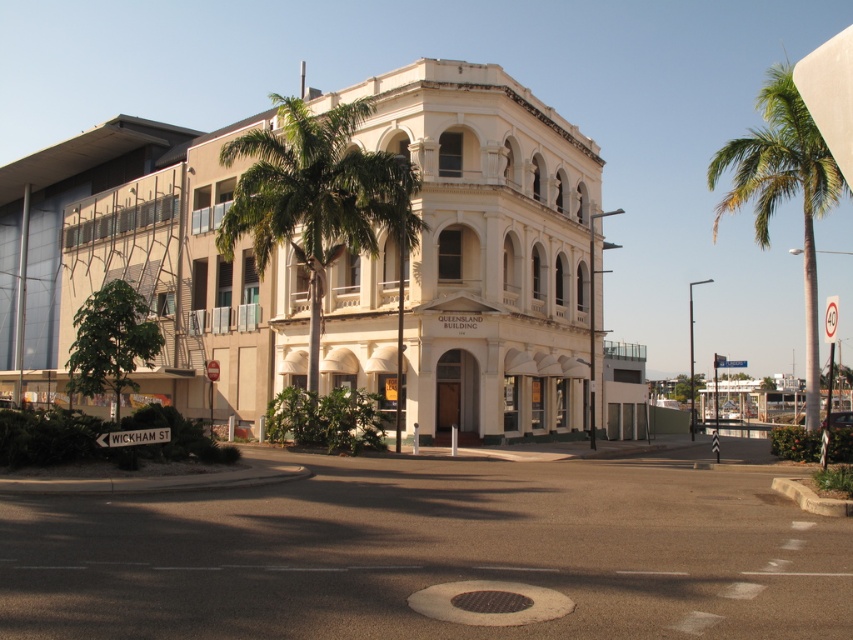
You are driving a delivery van that is 2.5 meters wide. You need to navigate through the street scene shown in the image. Can your van safely pass through the smooth asphalt road at center without hitting the green leafy palm tree at right?

The smooth asphalt road at center has a lesser width compared to green leafy palm tree at right, meaning the road is narrower than the palm tree. Since the van is 2.5 meters wide, it may not fit safely if the road is too narrow. However, the comparison here is between the road and the palm tree, not the road width relative to the van. Without specific measurements of the road width, it is uncertain if the van can pass safely.

From the picture: You are standing at the roundabout in front of the Queensland Building. You need to walk to the smooth asphalt road at center. Which direction should you walk to reach it?

You should walk towards the center of the roundabout to reach the smooth asphalt road at center, as it is located at point (430, 554).